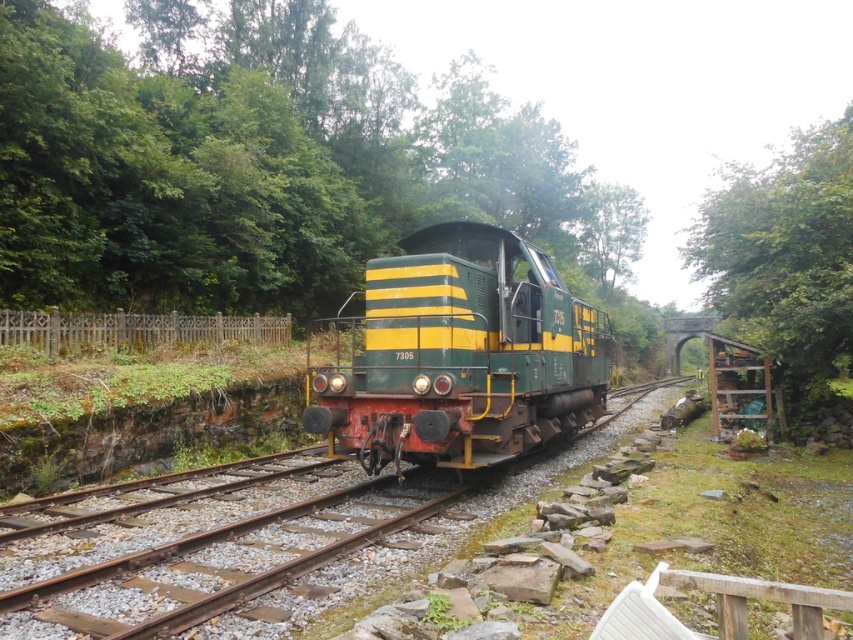
Question: Which of the following is the farthest from the observer?

Choices:
 (A) green leafy tree at upper center
 (B) green/yellow locomotive at center
 (C) green leafy tree at right
 (D) rusty metal fence at left

Answer: (A)

Question: Does green/yellow locomotive at center appear on the left side of green/yellow striped locomotive at center?

Choices:
 (A) no
 (B) yes

Answer: (A)

Question: Does green/yellow striped locomotive at center appear under green leafy tree at upper center?

Choices:
 (A) no
 (B) yes

Answer: (B)

Question: Which object is the farthest from the green leafy tree at upper center?

Choices:
 (A) green/yellow striped locomotive at center
 (B) green/yellow locomotive at center
 (C) green leafy tree at right

Answer: (A)

Question: Is green/yellow striped locomotive at center smaller than rusty metal fence at left?

Choices:
 (A) no
 (B) yes

Answer: (A)

Question: Which object is the closest to the green leafy tree at center?

Choices:
 (A) rusty metal fence at left
 (B) green/yellow striped locomotive at center

Answer: (B)